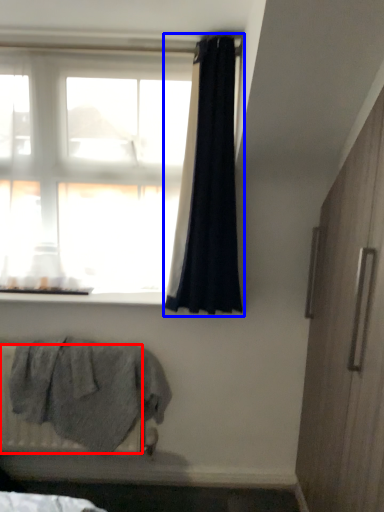
Question: Which object appears closest to the camera in this image, radiator (highlighted by a red box) or curtain (highlighted by a blue box)?

Choices:
 (A) radiator
 (B) curtain

Answer: (B)